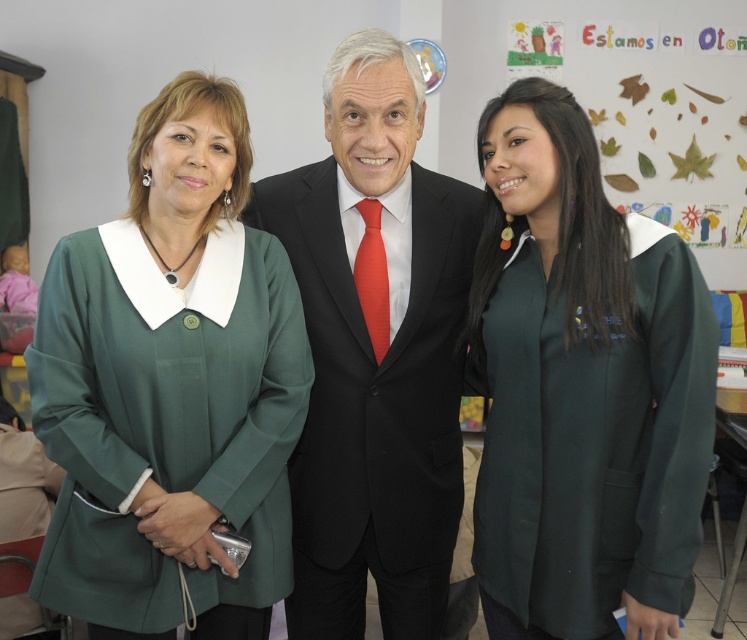
Question: Which object appears closest to the camera in this image?

Choices:
 (A) black matte suit at center
 (B) green paper leaves at upper right
 (C) green fabric coat at left

Answer: (C)

Question: Which of these objects is positioned farthest from the black matte suit at center?

Choices:
 (A) green fabric coat at left
 (B) green fabric shirt at center

Answer: (B)

Question: Estimate the real-world distances between objects in this image. Which object is farther from the black matte suit at center?

Choices:
 (A) green fabric shirt at center
 (B) green paper leaves at upper right
 (C) green fabric coat at left

Answer: (B)

Question: Does black matte suit at center have a larger size compared to green paper leaves at upper right?

Choices:
 (A) yes
 (B) no

Answer: (B)

Question: Is black matte suit at center below green paper leaves at upper right?

Choices:
 (A) yes
 (B) no

Answer: (A)

Question: Is green fabric shirt at center thinner than green paper leaves at upper right?

Choices:
 (A) yes
 (B) no

Answer: (A)